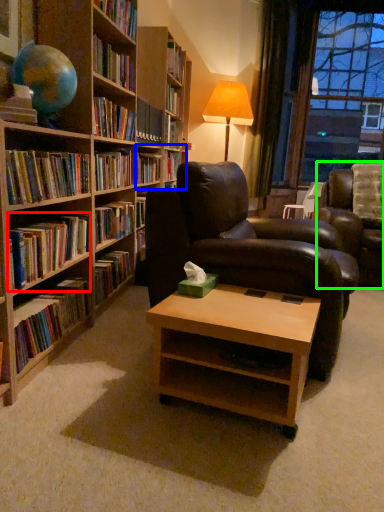
Question: Based on their relative distances, which object is nearer to book (highlighted by a red box)? Choose from shelf (highlighted by a blue box) and studio couch (highlighted by a green box).

Choices:
 (A) shelf
 (B) studio couch

Answer: (A)